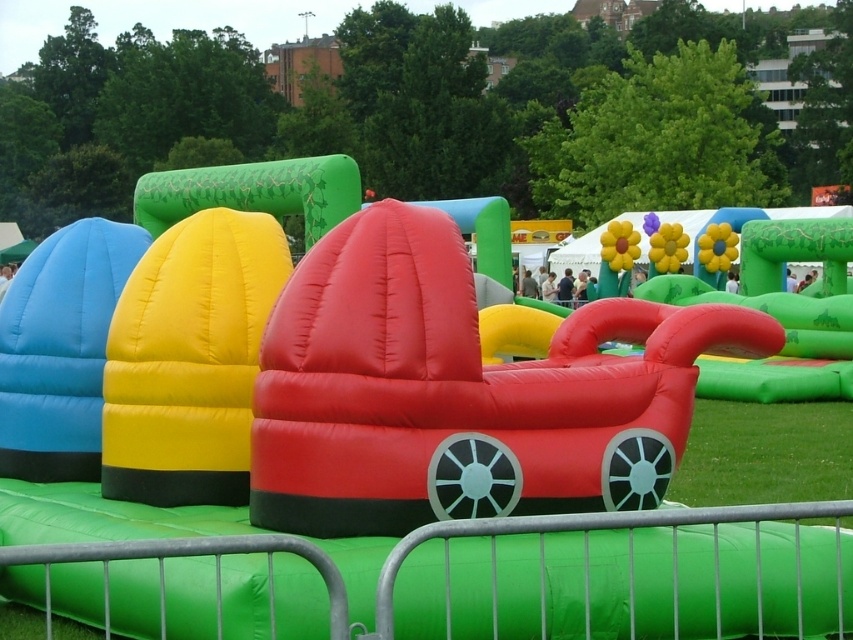
You are a participant in an obstacle course and need to jump from the rubberized red car at center to the green grass at lower right. Can you make the jump if your maximum jump distance is 3.8 meters?

The distance between the rubberized red car at center and the green grass at lower right is 3.92 meters, which is slightly longer than your maximum jump distance of 3.8 meters. Therefore, you might not be able to make the jump safely.

You are a participant in the obstacle course and need to navigate from the start to the finish. You see the rubberized red car at center and the green grass at lower right. Which object is closer to your current position if you are standing at the start line facing the obstacle course?

The rubberized red car at center is closer because it is in front of the green grass at lower right, meaning it is positioned between you and the grass.

You are standing at the entrance of the obstacle course and want to reach the green grass at lower right. Which direction should you move relative to the rubberized red car at center?

You should move to the right of the rubberized red car at center to reach the green grass at lower right since the green grass at lower right is located to the right of the rubberized red car at center.